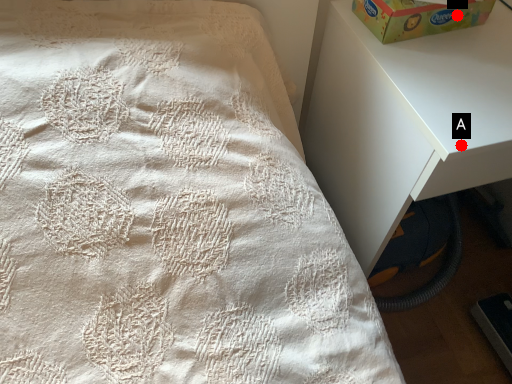
Question: Two points are circled on the image, labeled by A and B beside each circle. Which point is further to the camera?

Choices:
 (A) A is further
 (B) B is further

Answer: (B)